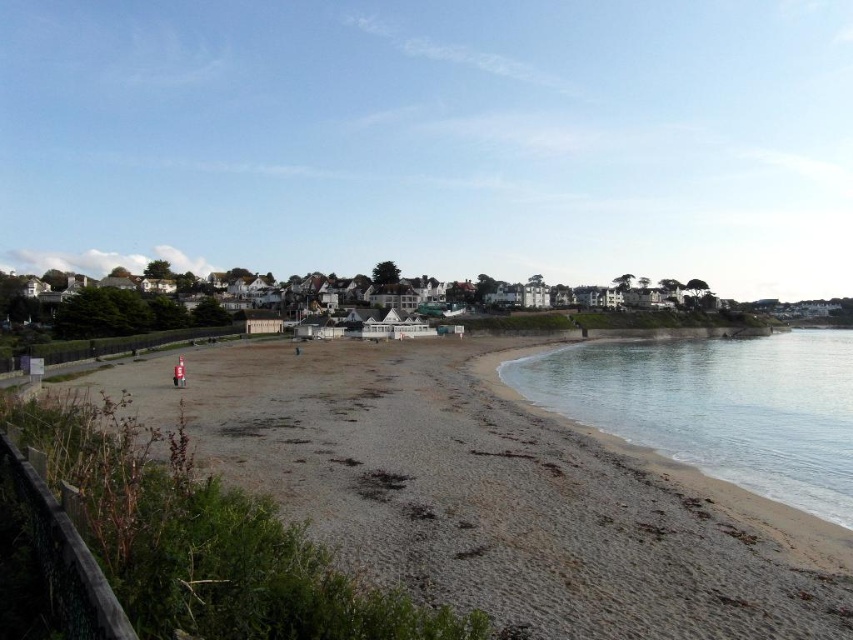
Is point (277, 346) positioned after point (711, 388)?

Yes, point (277, 346) is behind point (711, 388).

Does gray gravelly sand at lower left appear on the right side of clear water at beach right?

Incorrect, gray gravelly sand at lower left is not on the right side of clear water at beach right.

Between point (422, 400) and point (845, 392), which one is positioned behind?

The point (845, 392) is more distant.

The height and width of the screenshot is (640, 853). Find the location of `gray gravelly sand at lower left`. gray gravelly sand at lower left is located at coordinates (495, 492).